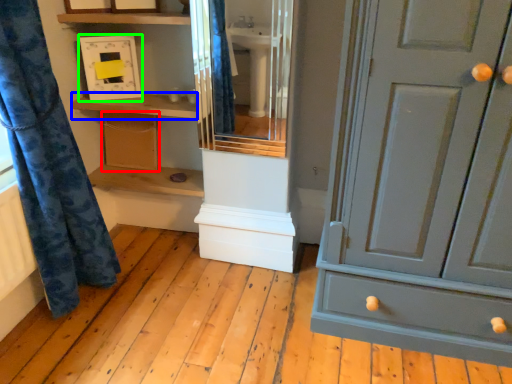
Question: Considering the real-world distances, which object is farthest from cabinetry (highlighted by a red box)? shelf (highlighted by a blue box) or medicine cabinet (highlighted by a green box)?

Choices:
 (A) shelf
 (B) medicine cabinet

Answer: (B)